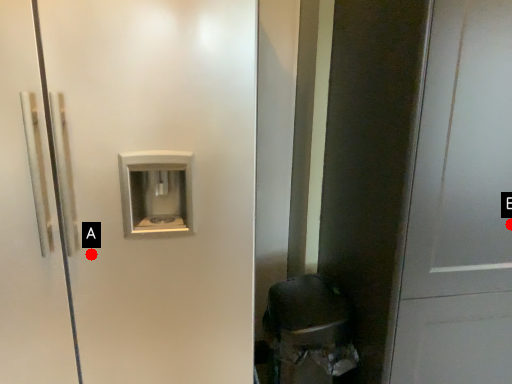
Question: Two points are circled on the image, labeled by A and B beside each circle. Which of the following is the farthest from the observer?

Choices:
 (A) A is further
 (B) B is further

Answer: (A)